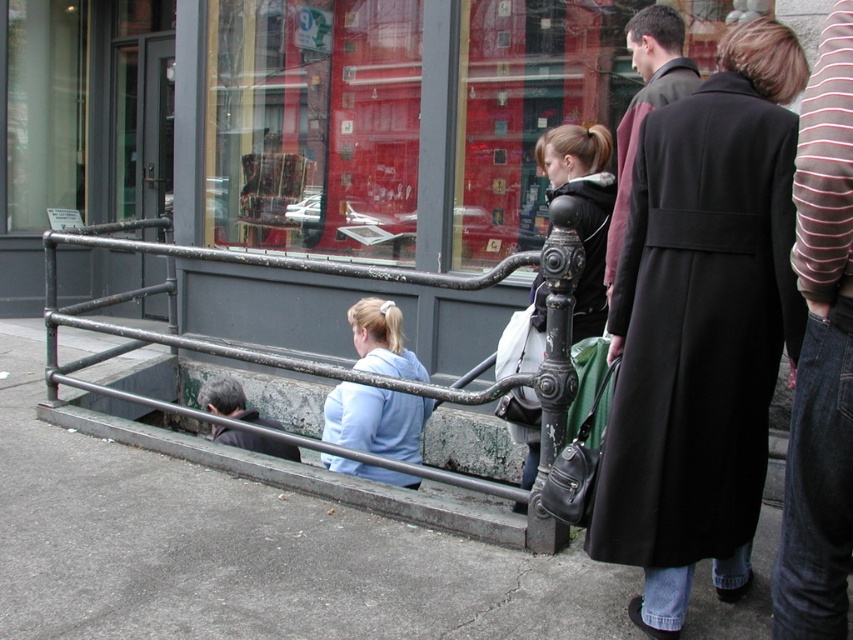
Who is higher up, black metal railing at lower center or light blue hoodie at center?

Positioned higher is black metal railing at lower center.

Is point (335, 369) less distant than point (392, 424)?

Yes, it is.

The image size is (853, 640). I want to click on black metal railing at lower center, so click(x=309, y=358).

The image size is (853, 640). Describe the element at coordinates (309, 358) in the screenshot. I see `black metal railing at lower center` at that location.

Describe the element at coordinates (309, 358) in the screenshot. Image resolution: width=853 pixels, height=640 pixels. I see `black metal railing at lower center` at that location.

At what (x,y) coordinates should I click in order to perform the action: click on black metal railing at lower center. Please return your answer as a coordinate pair (x, y). The image size is (853, 640). Looking at the image, I should click on (309, 358).

Does red glass window at center appear on the right side of light blue hoodie at center?

In fact, red glass window at center is to the left of light blue hoodie at center.

Who is more forward, (311, 234) or (369, 426)?

Point (369, 426) is more forward.

The width and height of the screenshot is (853, 640). Describe the element at coordinates (395, 118) in the screenshot. I see `red glass window at center` at that location.

This screenshot has height=640, width=853. I want to click on red glass window at center, so click(395, 118).